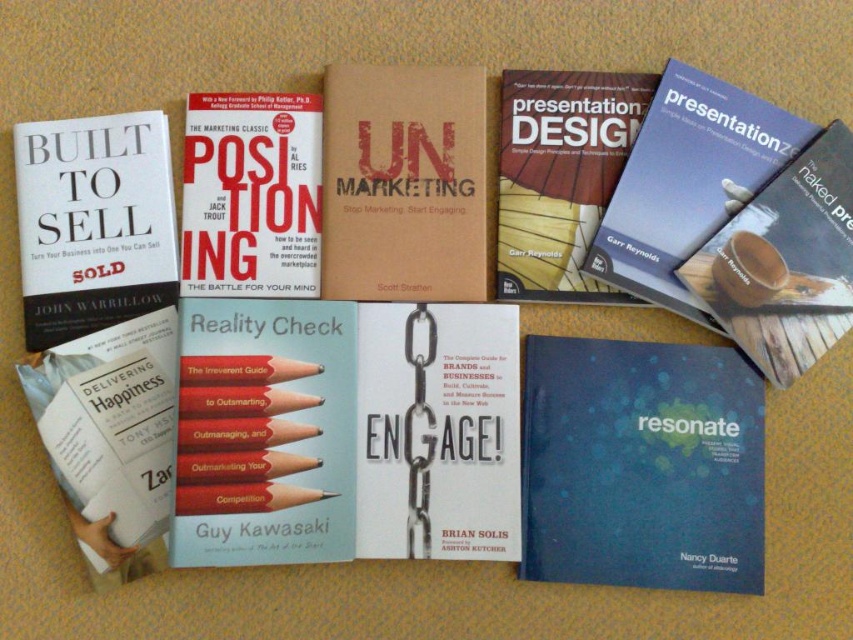
Between point (427, 177) and point (759, 252), which one is positioned in front?

Point (759, 252) is more forward.

Looking at this image, is brown matte/uncoated book at center to the right of matte blue book at center from the viewer's perspective?

In fact, brown matte/uncoated book at center is to the left of matte blue book at center.

Is point (329, 248) positioned before point (718, 310)?

That is False.

Where is `brown matte/uncoated book at center`? Image resolution: width=853 pixels, height=640 pixels. brown matte/uncoated book at center is located at coordinates (403, 182).

Does blue matte presentation book at upper right appear on the right side of matte blue book at center?

No, blue matte presentation book at upper right is not to the right of matte blue book at center.

Measure the distance between point [732,132] and camera.

A distance of 37.69 inches exists between point [732,132] and camera.

This screenshot has width=853, height=640. Find the location of `blue matte presentation book at upper right`. blue matte presentation book at upper right is located at coordinates (688, 182).

In the scene shown: Who is more distant from viewer, (308, 412) or (755, 193)?

The point (755, 193) is more distant.

Can you confirm if blue pencil at center is shorter than matte blue book at center?

Yes, blue pencil at center is shorter than matte blue book at center.

What do you see at coordinates (265, 433) in the screenshot? The height and width of the screenshot is (640, 853). I see `blue pencil at center` at bounding box center [265, 433].

Locate an element on the screen. The height and width of the screenshot is (640, 853). blue pencil at center is located at coordinates (265, 433).